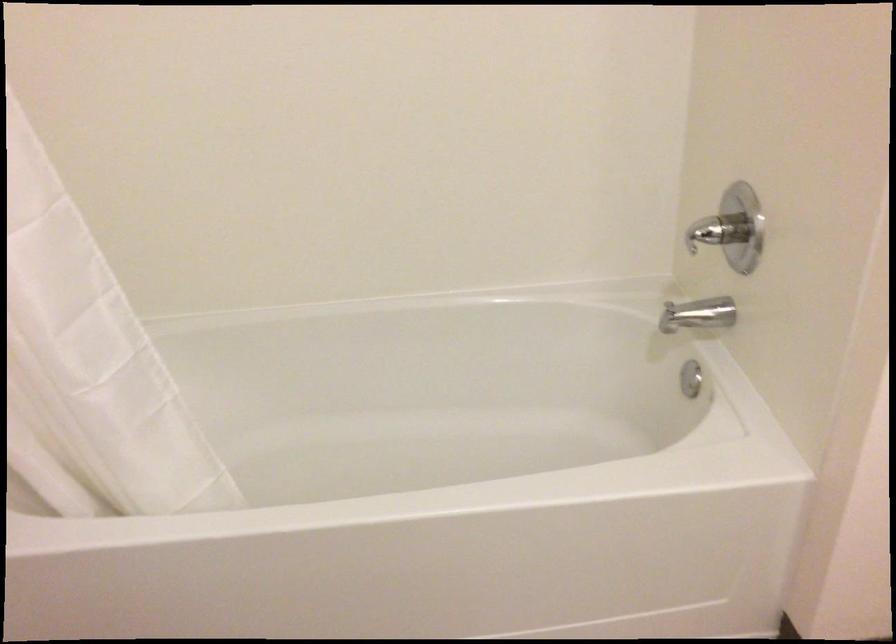
Locate an element on the screen. The height and width of the screenshot is (644, 896). faucet diverter knob is located at coordinates (725, 231).